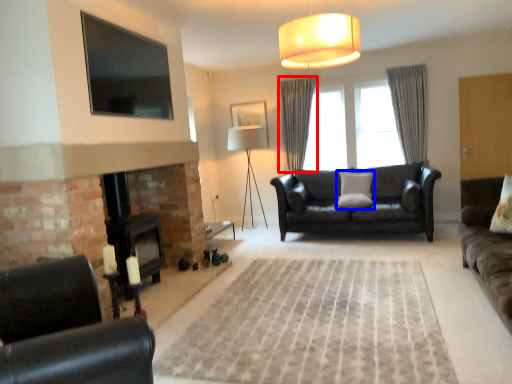
Question: Which point is closer to the camera, curtain (highlighted by a red box) or pillow (highlighted by a blue box)?

Choices:
 (A) curtain
 (B) pillow

Answer: (B)